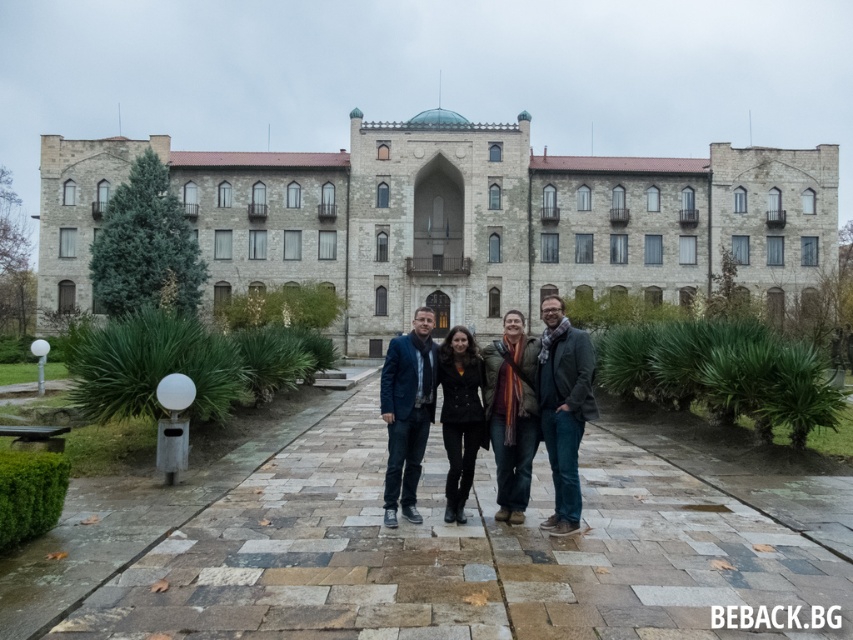
Does orange striped scarf at center have a lesser height compared to dark blue textured blazer at center?

Yes, orange striped scarf at center is shorter than dark blue textured blazer at center.

Does orange striped scarf at center lie behind dark blue textured blazer at center?

Yes, orange striped scarf at center is further from the viewer.

Is point (503, 448) positioned after point (409, 468)?

Yes, point (503, 448) is behind point (409, 468).

What are the coordinates of `orange striped scarf at center` in the screenshot? It's located at (511, 413).

Can you confirm if dark gray wool scarf at center is bigger than dark blue textured blazer at center?

Yes, dark gray wool scarf at center is bigger than dark blue textured blazer at center.

Identify the location of dark gray wool scarf at center. (563, 408).

Which is above, dark gray wool scarf at center or black leather jacket at center?

dark gray wool scarf at center

Between point (543, 364) and point (445, 372), which one is positioned in front?

Positioned in front is point (543, 364).

Where is `dark gray wool scarf at center`? The width and height of the screenshot is (853, 640). dark gray wool scarf at center is located at coordinates click(563, 408).